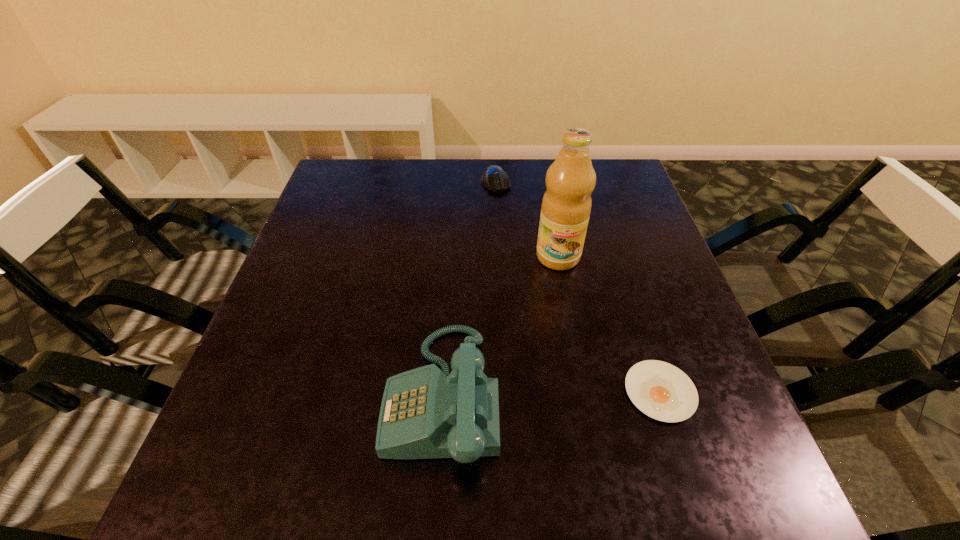
Where is `free spot on the desktop that is between the third shortest object and the shortest object and is positioned on the button side of the second shortest object`? The width and height of the screenshot is (960, 540). free spot on the desktop that is between the third shortest object and the shortest object and is positioned on the button side of the second shortest object is located at coordinates (552, 393).

The width and height of the screenshot is (960, 540). I want to click on vacant spot on the desktop that is between the third shortest object and the shortest object and is positioned on the label of the third nearest object, so click(559, 393).